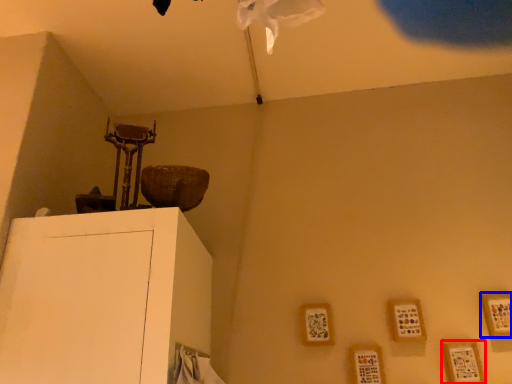
Question: Which object appears closest to the camera in this image, picture frame (highlighted by a red box) or picture frame (highlighted by a blue box)?

Choices:
 (A) picture frame
 (B) picture frame

Answer: (A)